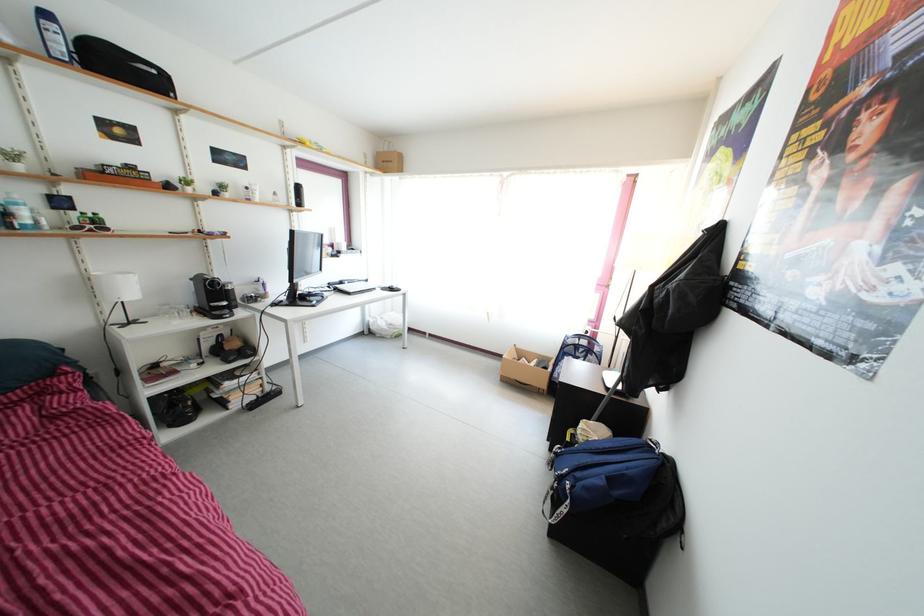
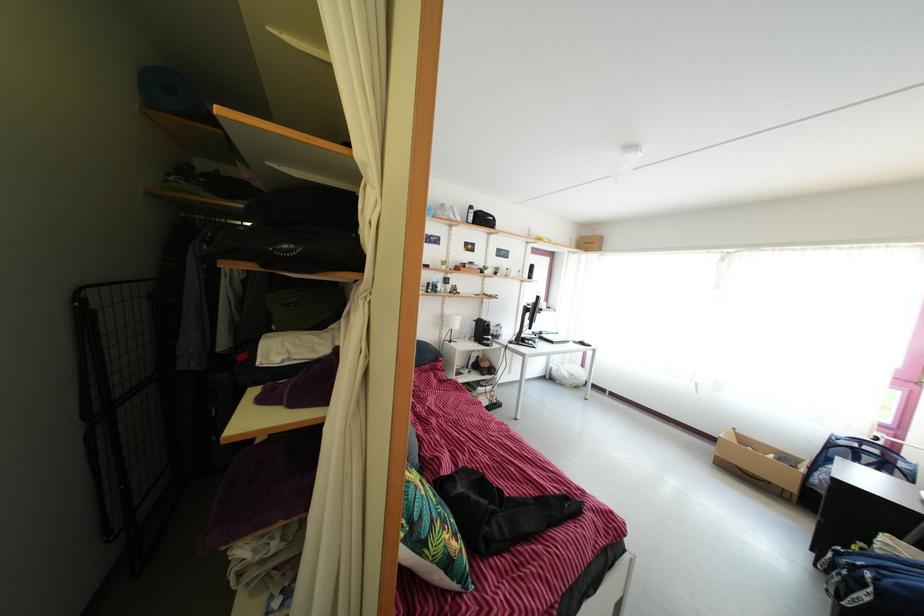
The point at (84, 270) is marked in the first image. Where is the corresponding point in the second image?

(448, 315)